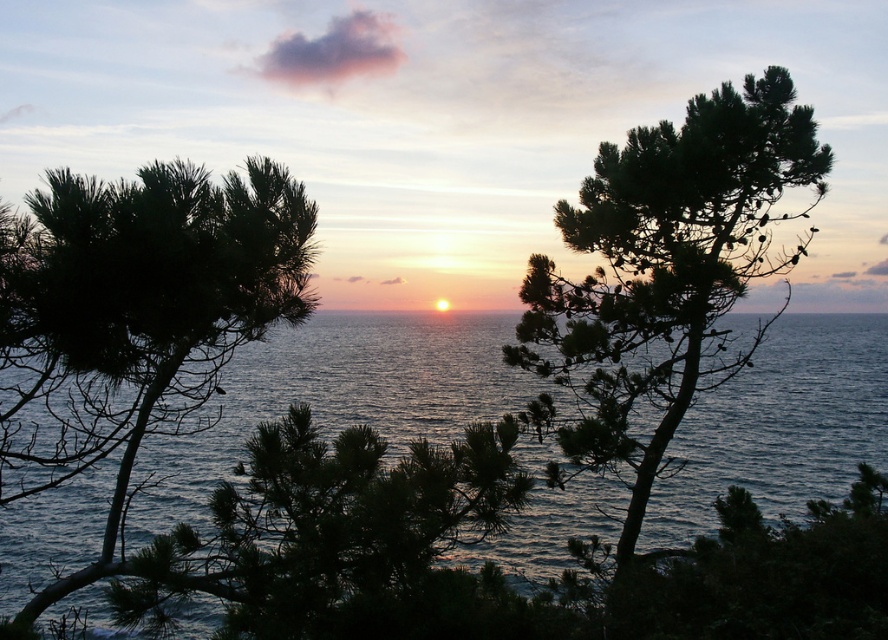
Looking at this image, what is the relationship between the size of the dark green textured tree at upper right and the dark green pine tree at center in the sunset scene?

The dark green textured tree at upper right occupies less space than the dark green pine tree at center.

You are a bird flying over the sunset scene. You see the dark green textured tree at upper right and the dark green pine tree at center. Which tree is closer to the water?

The dark green textured tree at upper right is positioned under the dark green pine tree at center, so it is closer to the water.

You are standing in the sunset scene and want to place a small flag at each of the two points marked in the image. Which point, point (177, 260) or point (355, 614), is closer to you where you should plant the first flag?

Point (177, 260) is closer to the viewer than point (355, 614), so you should plant the first flag there.